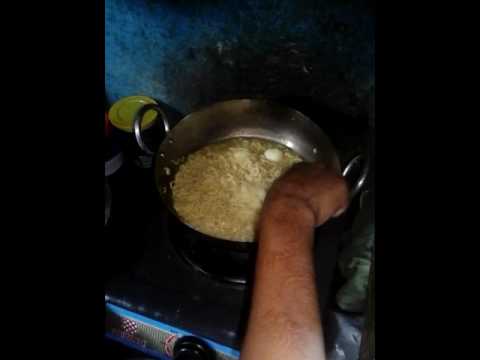
Locate an element on the screen. The height and width of the screenshot is (360, 480). metal handles is located at coordinates (137, 118), (352, 161).